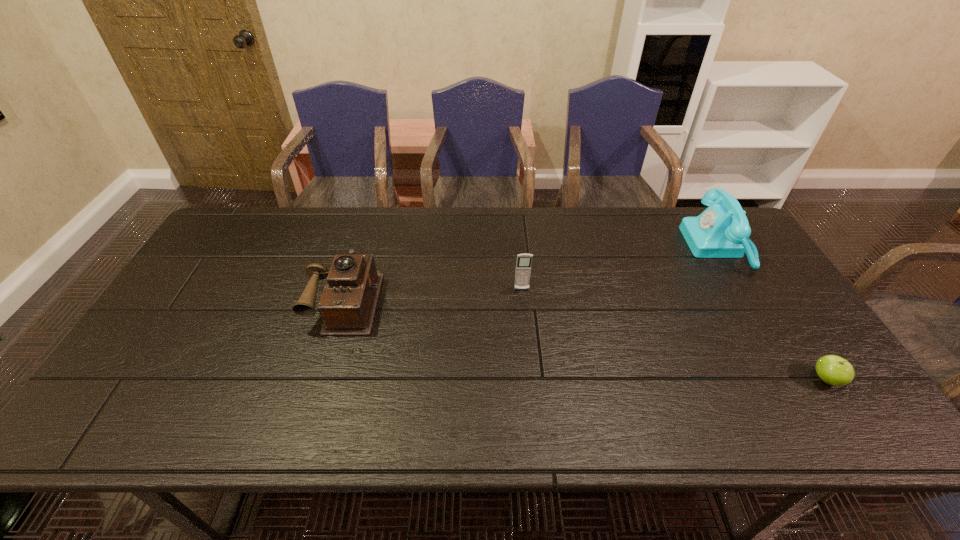
Where is `vacant space situated on the back of the shortest object`? This screenshot has width=960, height=540. vacant space situated on the back of the shortest object is located at coordinates 781,312.

Find the location of `object that is at the far edge`. object that is at the far edge is located at coordinates (722, 230).

Locate an element on the screen. telephone that is at the right edge is located at coordinates (722, 230).

This screenshot has height=540, width=960. Identify the location of apple that is at the right edge. (833, 370).

Find the location of `object located at the far right corner`. object located at the far right corner is located at coordinates (722, 230).

The height and width of the screenshot is (540, 960). What are the coordinates of `vacant region at the far edge of the desktop` in the screenshot? It's located at (319, 207).

This screenshot has width=960, height=540. In order to click on vacant space at the left edge of the desktop in this screenshot , I will do `click(224, 287)`.

In the image, there is a desktop. Where is `vacant space at the right edge`? vacant space at the right edge is located at coordinates (768, 316).

Find the location of a particular element. This screenshot has height=540, width=960. free space between the telephone and the cellular telephone is located at coordinates (620, 268).

This screenshot has width=960, height=540. Find the location of `vacant point located between the apple and the leftmost object`. vacant point located between the apple and the leftmost object is located at coordinates (586, 340).